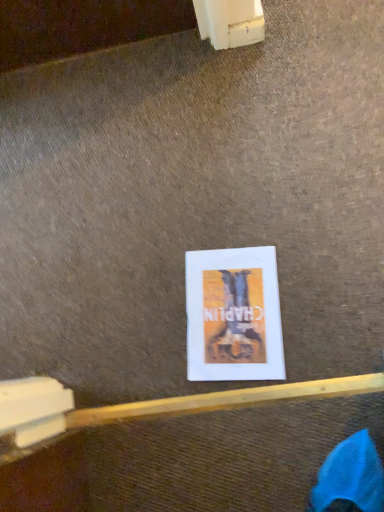
This screenshot has width=384, height=512. What are the coordinates of `unoccupied space behind white paper at center` in the screenshot? It's located at (171, 238).